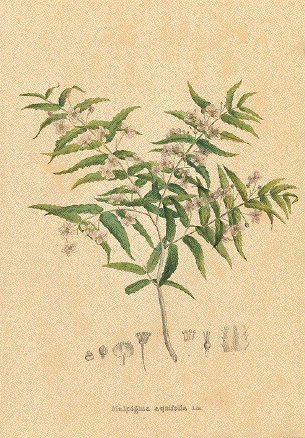
This screenshot has width=305, height=438. What are the coordinates of `space to the right of the plant` in the screenshot? It's located at tap(283, 159).